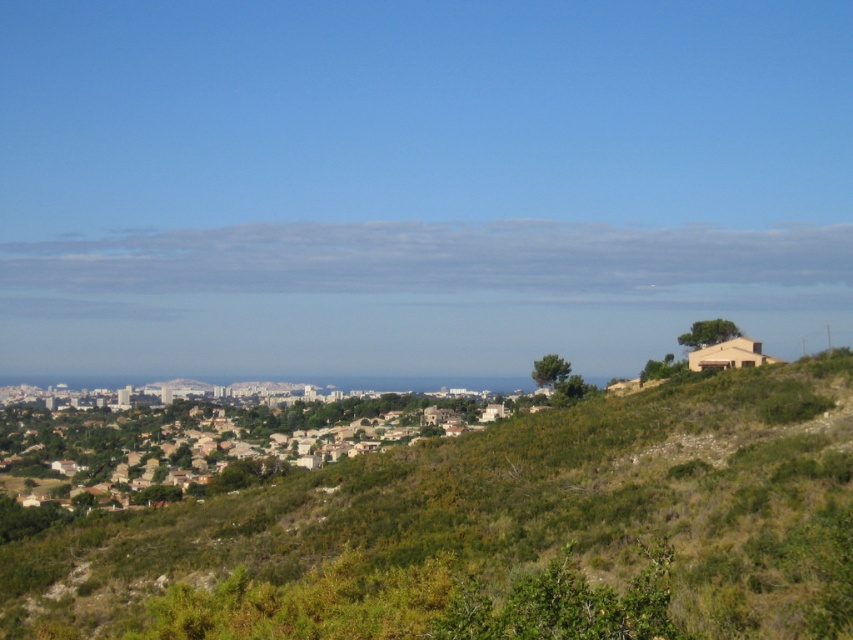
Which is in front, point (775, 461) or point (76, 456)?

Point (775, 461) is more forward.

Is green shrubbery at center to the right of brown stone houses at lower left from the viewer's perspective?

Correct, you'll find green shrubbery at center to the right of brown stone houses at lower left.

The width and height of the screenshot is (853, 640). Find the location of `green shrubbery at center`. green shrubbery at center is located at coordinates (491, 524).

Locate an element on the screen. This screenshot has height=640, width=853. green shrubbery at center is located at coordinates (491, 524).

This screenshot has width=853, height=640. Describe the element at coordinates (206, 436) in the screenshot. I see `brown stone houses at lower left` at that location.

Describe the element at coordinates (206, 436) in the screenshot. This screenshot has width=853, height=640. I see `brown stone houses at lower left` at that location.

You are a GUI agent. You are given a task and a screenshot of the screen. Output one action in this format:
    pyautogui.click(x=<x>, y=<y>)
    Task: Click on the brown stone houses at lower left
    
    Given the screenshot: What is the action you would take?
    pyautogui.click(x=206, y=436)

Who is taller, green shrubbery at center or beige matte house at right?

green shrubbery at center is taller.

Is green shrubbery at center bigger than beige matte house at right?

Correct, green shrubbery at center is larger in size than beige matte house at right.

Which is in front, point (96, 589) or point (714, 368)?

Positioned in front is point (96, 589).

Identify the location of green shrubbery at center. (491, 524).